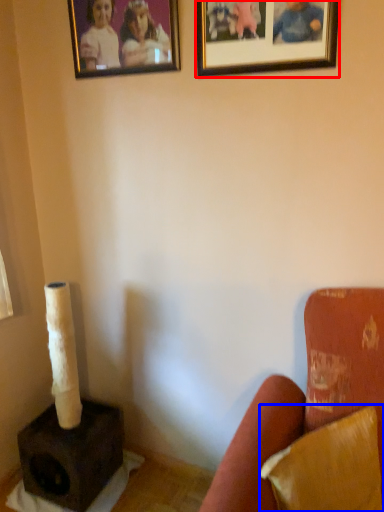
Question: Which point is closer to the camera, picture frame (highlighted by a red box) or pillow (highlighted by a blue box)?

Choices:
 (A) picture frame
 (B) pillow

Answer: (B)